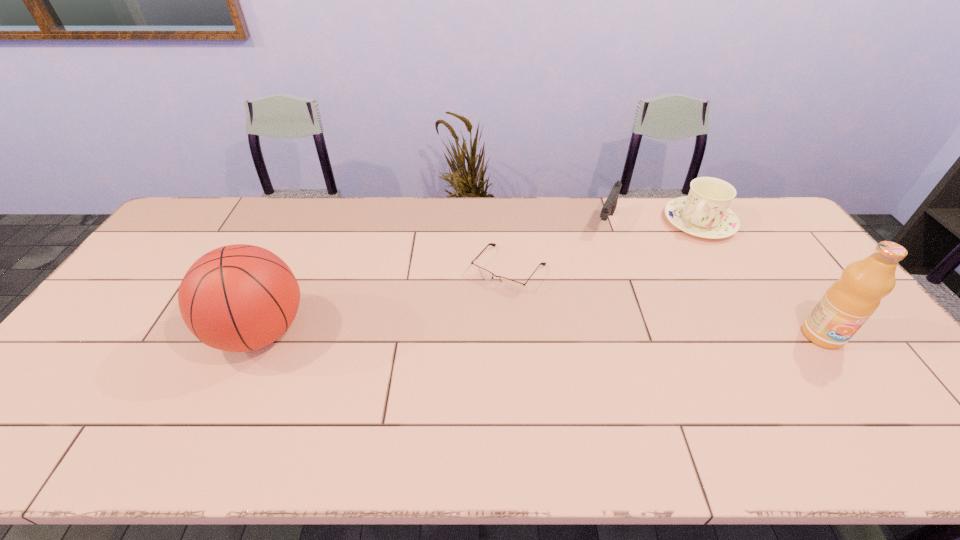
This screenshot has height=540, width=960. Identify the location of free region located at the barrel of the pistol. (575, 296).

At what (x,y) coordinates should I click in order to perform the action: click on vacant space located on the handle side of the chinaware. Please return your answer as a coordinate pair (x, y). The image size is (960, 540). Looking at the image, I should click on (647, 287).

The height and width of the screenshot is (540, 960). What are the coordinates of `free space located 0.290m on the handle side of the chinaware` in the screenshot? It's located at pos(648,286).

This screenshot has height=540, width=960. Find the location of `blank space located 0.220m on the handle side of the chinaware`. blank space located 0.220m on the handle side of the chinaware is located at coordinates (658, 273).

Where is `free space located 0.400m on the front-facing side of the second object from left to right`? free space located 0.400m on the front-facing side of the second object from left to right is located at coordinates (407, 394).

Locate an element on the screen. This screenshot has width=960, height=540. blank area located on the front-facing side of the second object from left to right is located at coordinates (480, 304).

At what (x,y) coordinates should I click in order to perform the action: click on free space located 0.350m on the front-facing side of the second object from left to right. Please return your answer as a coordinate pair (x, y). This screenshot has width=960, height=540. Looking at the image, I should click on (420, 379).

Where is `pistol that is at the far edge`? pistol that is at the far edge is located at coordinates (610, 204).

Locate an element on the screen. This screenshot has width=960, height=540. chinaware positioned at the far edge is located at coordinates (704, 213).

Where is `fruit juice at the right edge`? fruit juice at the right edge is located at coordinates tap(848, 303).